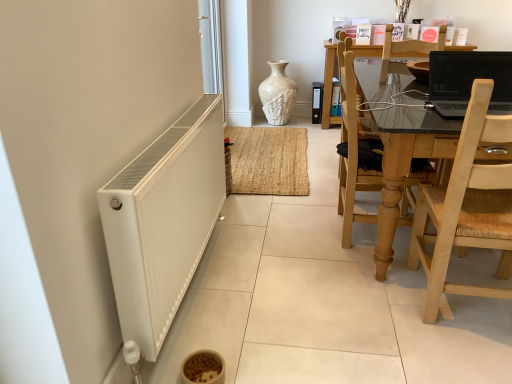
Find the location of a particular element. The image size is (512, 384). vacant space in front of wooden chair at right, positioned as the first chair in back-to-front order is located at coordinates (362, 275).